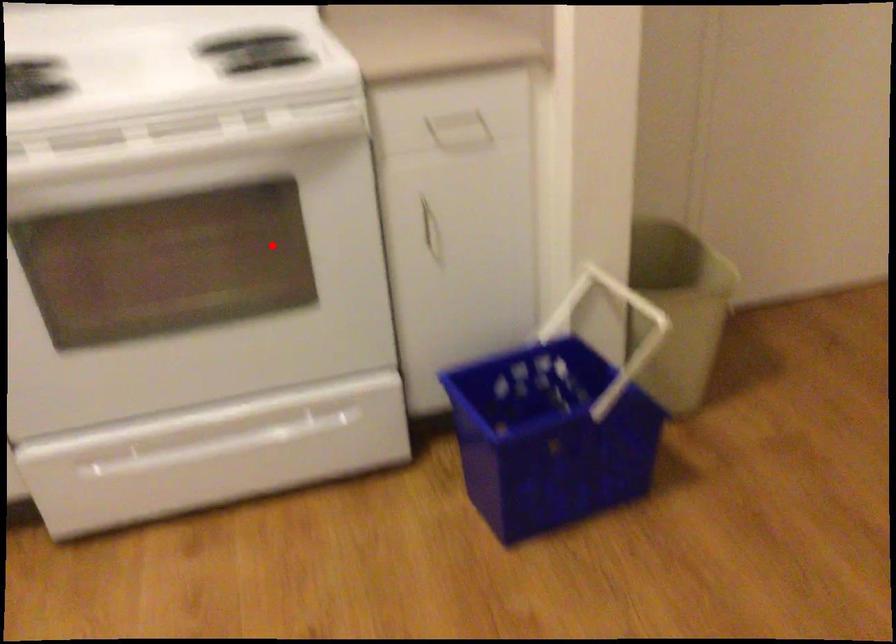
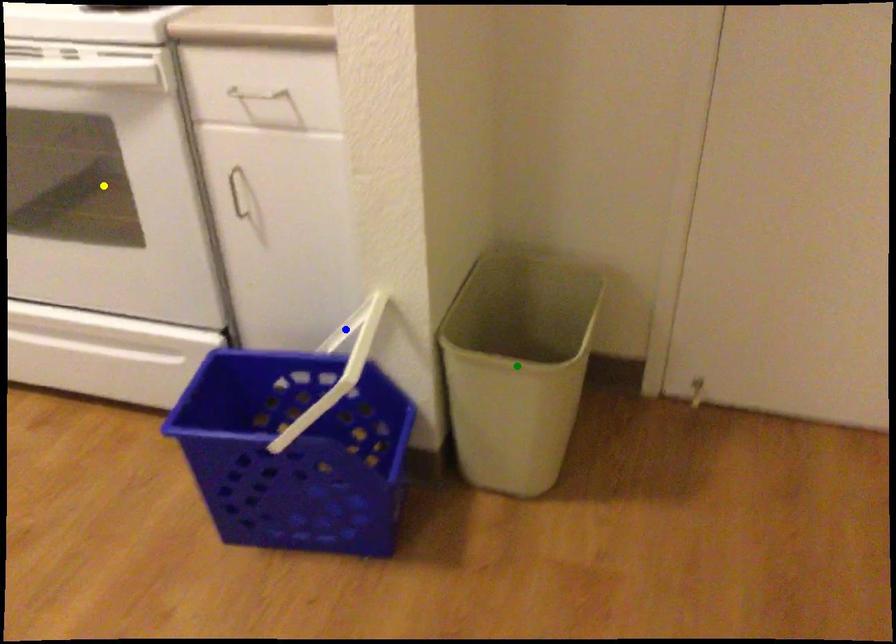
Question: I am providing you with two images of the same scene from different viewpoints. A red point is marked on the first image. You are given multiple points on the second image. Which point in image 2 represents the same 3d spot as the red point in image 1?

Choices:
 (A) blue point
 (B) green point
 (C) yellow point

Answer: (C)